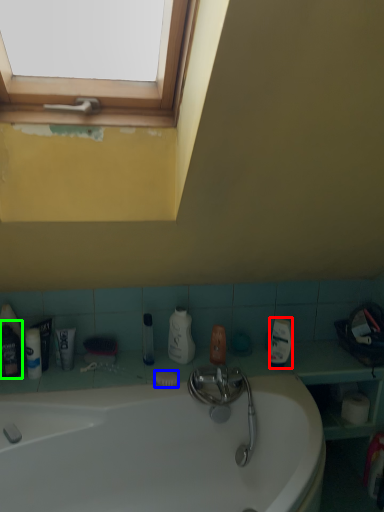
Question: Estimate the real-world distances between objects in this image. Which object is closer to cleaning product (highlighted by a red box), soap (highlighted by a blue box) or mouthwash (highlighted by a green box)?

Choices:
 (A) soap
 (B) mouthwash

Answer: (A)